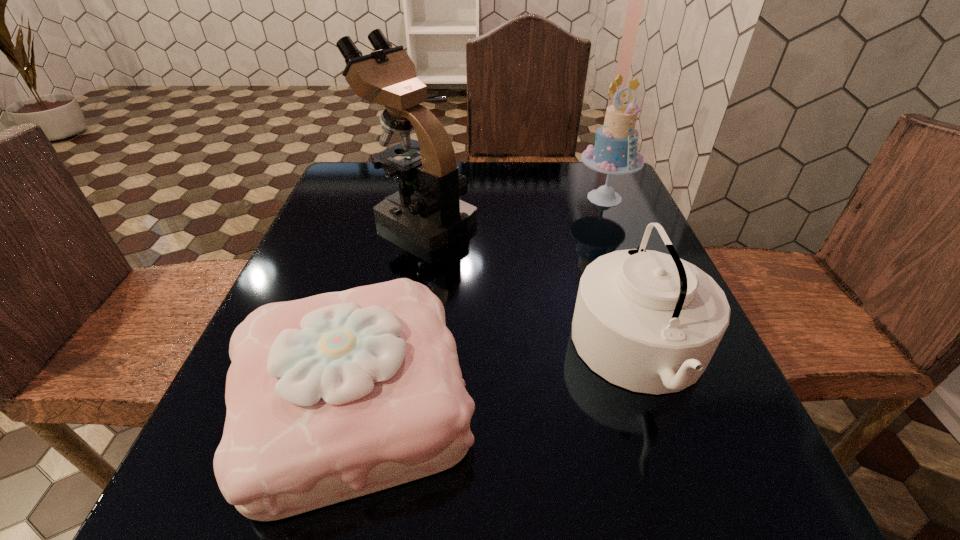
In order to click on free space that satisfies the following two spatial constraints: 1. with a ladder on the side of the third shortest object; 2. on the spout of the third tallest object in this screenshot , I will do `click(667, 353)`.

Locate an element on the screen. The image size is (960, 540). free space that satisfies the following two spatial constraints: 1. with a ladder on the side of the taller cake; 2. on the spout of the kettle is located at coordinates (667, 353).